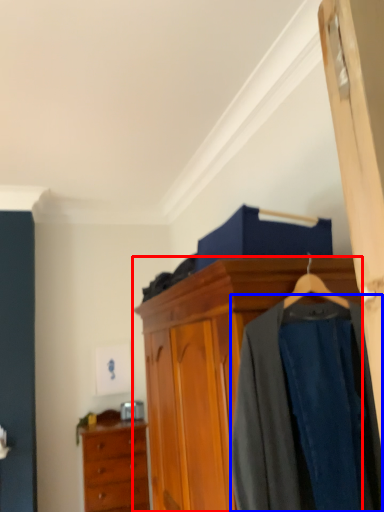
Question: Which object appears farthest to the camera in this image, cabinetry (highlighted by a red box) or clothing (highlighted by a blue box)?

Choices:
 (A) cabinetry
 (B) clothing

Answer: (B)